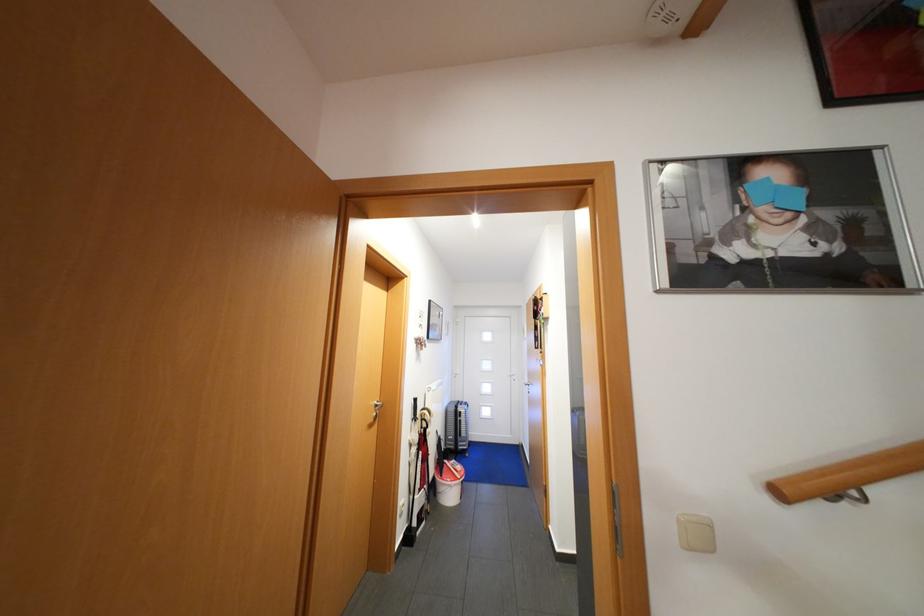
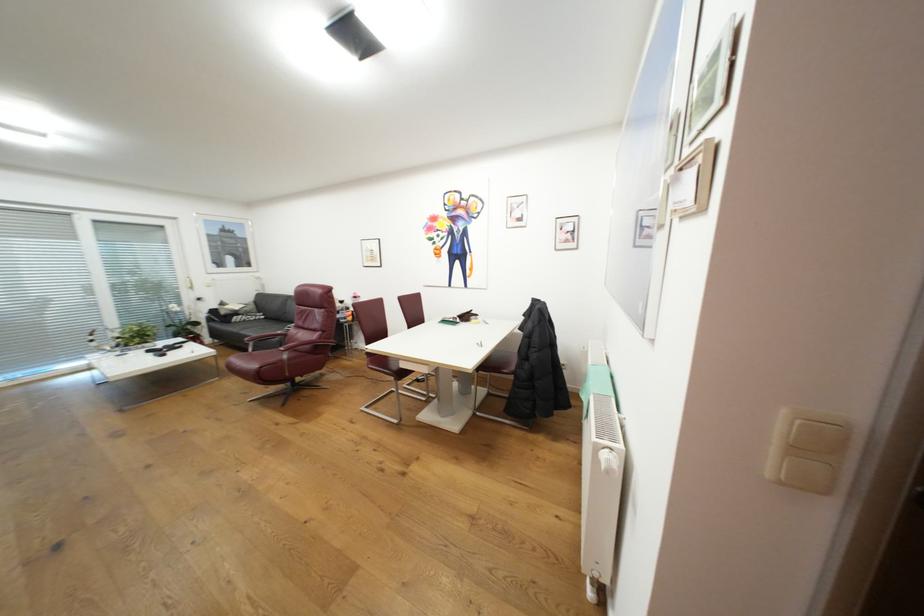
Question: The camera is either moving clockwise (left) or counter-clockwise (right) around the object. The first image is from the beginning of the video and the second image is from the end. Is the camera moving left or right when shooting the video?

Choices:
 (A) Left
 (B) Right

Answer: (B)